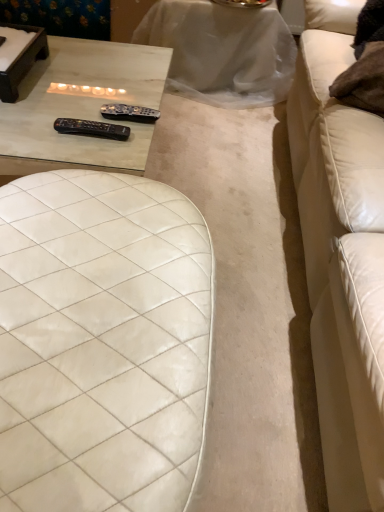
Locate an element on the screen. Image resolution: width=384 pixels, height=512 pixels. free space above white quilted leather ottoman at center (from a real-world perspective) is located at coordinates (82, 285).